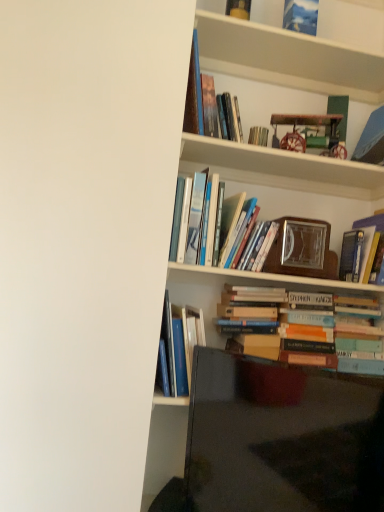
Question: Does matte yellow book at upper center, arranged as the first book when viewed from the top, have a smaller size compared to hardcover books at center, which is the fifth book from bottom to top?

Choices:
 (A) no
 (B) yes

Answer: (B)

Question: Is matte yellow book at upper center, arranged as the first book when viewed from the top, outside of hardcover books at center, which is the fifth book from bottom to top?

Choices:
 (A) no
 (B) yes

Answer: (B)

Question: Does matte yellow book at upper center, arranged as the first book when viewed from the top, have a larger size compared to hardcover books at center, which is the fifth book from bottom to top?

Choices:
 (A) yes
 (B) no

Answer: (B)

Question: Is matte yellow book at upper center, marked as the eighth book in a bottom-to-top arrangement, positioned before hardcover books at center, which is the fifth book from bottom to top?

Choices:
 (A) no
 (B) yes

Answer: (A)

Question: Does matte yellow book at upper center, arranged as the first book when viewed from the top, appear on the right side of hardcover books at center, which is counted as the fourth book, starting from the top?

Choices:
 (A) yes
 (B) no

Answer: (A)

Question: From the image's perspective, is matte yellow book at upper center, marked as the eighth book in a bottom-to-top arrangement, located above hardcover books at center, which is the fifth book from bottom to top?

Choices:
 (A) yes
 (B) no

Answer: (A)

Question: From a real-world perspective, is metallic silver book at upper center, the sixth book in the bottom-to-top sequence, beneath hardcover book at upper right, which appears as the sixth book when viewed from the top?

Choices:
 (A) yes
 (B) no

Answer: (B)

Question: Can you confirm if metallic silver book at upper center, marked as the 3th book in a top-to-bottom arrangement, is bigger than hardcover book at upper right, the 3th book in the bottom-to-top sequence?

Choices:
 (A) no
 (B) yes

Answer: (A)

Question: Does metallic silver book at upper center, the sixth book in the bottom-to-top sequence, come in front of hardcover book at upper right, which appears as the sixth book when viewed from the top?

Choices:
 (A) no
 (B) yes

Answer: (A)

Question: Does metallic silver book at upper center, the sixth book in the bottom-to-top sequence, appear on the right side of hardcover book at upper right, which appears as the sixth book when viewed from the top?

Choices:
 (A) yes
 (B) no

Answer: (B)

Question: Considering the relative sizes of metallic silver book at upper center, marked as the 3th book in a top-to-bottom arrangement, and hardcover book at upper right, the 3th book in the bottom-to-top sequence, in the image provided, is metallic silver book at upper center, marked as the 3th book in a top-to-bottom arrangement, shorter than hardcover book at upper right, the 3th book in the bottom-to-top sequence,?

Choices:
 (A) yes
 (B) no

Answer: (A)

Question: Is metallic silver book at upper center, marked as the 3th book in a top-to-bottom arrangement, smaller than hardcover book at upper right, which appears as the sixth book when viewed from the top?

Choices:
 (A) yes
 (B) no

Answer: (A)

Question: Does wooden bookshelf at upper center have a greater width compared to hardcover books at center, which is the fifth book from bottom to top?

Choices:
 (A) yes
 (B) no

Answer: (B)